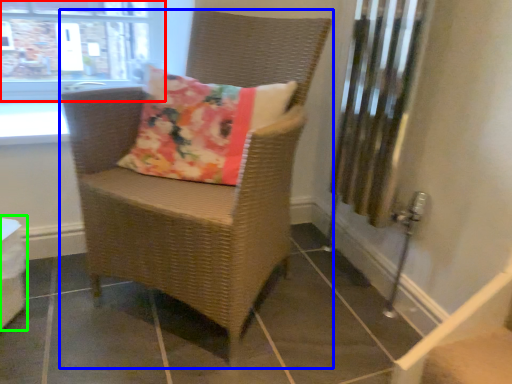
Question: Which object is positioned closest to window (highlighted by a red box)? Select from chair (highlighted by a blue box) and table (highlighted by a green box).

Choices:
 (A) chair
 (B) table

Answer: (A)